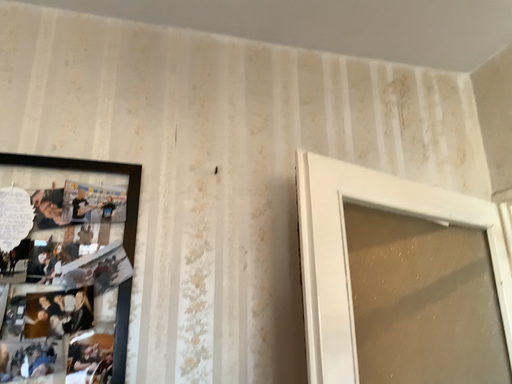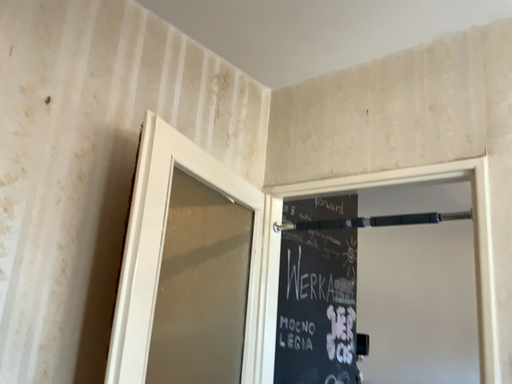
Question: How did the camera likely rotate when shooting the video?

Choices:
 (A) rotated downward
 (B) rotated upward

Answer: (A)